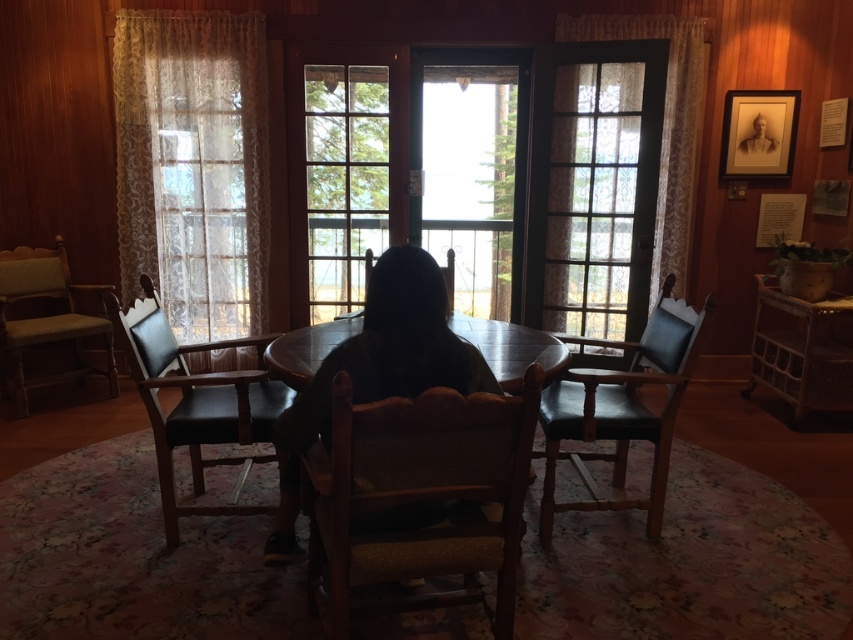
The image size is (853, 640). Find the location of `clear glass door at center`. clear glass door at center is located at coordinates (593, 186).

In the scene shown: Does clear glass door at center lie in front of matte black chair at center?

That is False.

Does point (561, 312) come in front of point (672, 339)?

No, it is not.

In order to click on clear glass door at center in this screenshot , I will do `click(593, 186)`.

From the picture: Is dark brown leather chair at center wider than wooden table at center?

Yes, dark brown leather chair at center is wider than wooden table at center.

Does dark brown leather chair at center have a lesser width compared to wooden table at center?

Incorrect, dark brown leather chair at center's width is not less than wooden table at center's.

Who is more distant from viewer, [384,392] or [312,339]?

Positioned behind is point [312,339].

Find the location of a particular element. dark brown leather chair at center is located at coordinates (376, 371).

Can you confirm if wooden table at center is thinner than wooden chair at center?

No, wooden table at center is not thinner than wooden chair at center.

Is point (494, 333) less distant than point (448, 298)?

Yes, point (494, 333) is closer to viewer.

Is point (311, 353) positioned behind point (352, 316)?

No, it is in front of (352, 316).

Locate an element on the screen. This screenshot has height=640, width=853. wooden table at center is located at coordinates (511, 348).